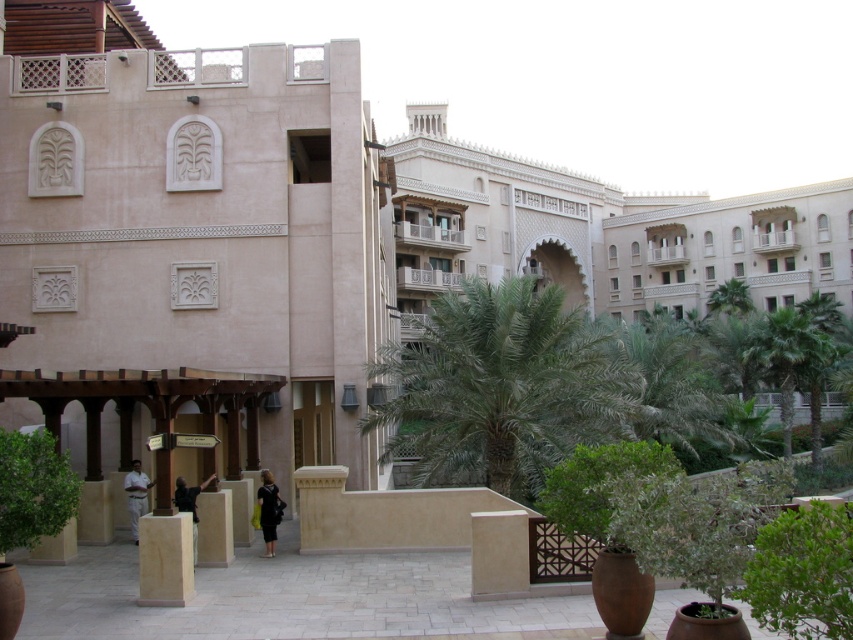
You are a landscape architect designing a new courtyard and want to ensure proper spacing between the matte beige building at center and the green leafy bush at lower left. Based on the image, which object has a greater width and thus requires more space in the courtyard layout?

The matte beige building at center has a greater width than the green leafy bush at lower left, so it requires more space in the courtyard layout.

You are a landscape architect designing a new courtyard. You want to ensure that the green leafy palm tree at center is visible from the entrance pathway. Given the matte beige building at center is in the way, can you confirm if the palm tree is smaller than the building?

The matte beige building at center has a larger size compared to the green leafy palm tree at center, so yes, the palm tree is smaller and may still be visible from the entrance pathway as it is not as tall as the building.